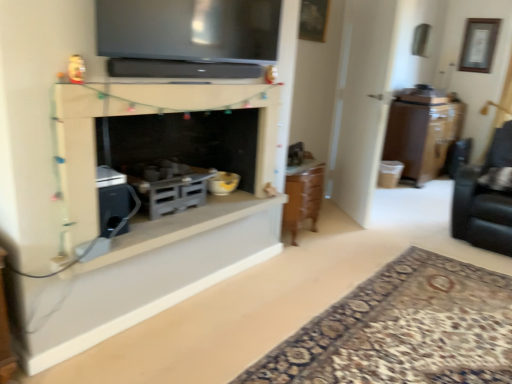
Where is `free space to the right of white smooth baseboard at lower center, which ranks as the 2th window sill in top-to-bottom order`? The height and width of the screenshot is (384, 512). free space to the right of white smooth baseboard at lower center, which ranks as the 2th window sill in top-to-bottom order is located at coordinates (333, 300).